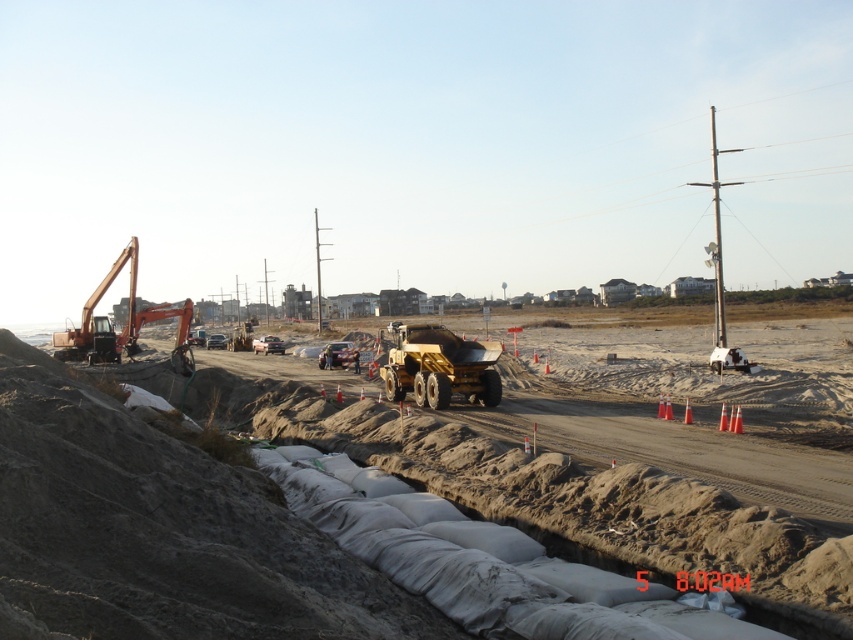
You are a construction worker standing at the edge of the trench filled with white sandbags. You need to move a heavy equipment part from the matte yellow truck at center to the yellow metallic dump truck at center. What is the minimum distance you need to carry the part?

The matte yellow truck at center and yellow metallic dump truck at center are 6.50 meters apart, so the minimum distance you need to carry the part is 6.50 meters.

You are a construction worker who needs to transport materials from the orange metallic excavator at left to the matte yellow truck at center. Considering their sizes, which vehicle can carry more materials?

The matte yellow truck at center is larger in size than the orange metallic excavator at left, so it can carry more materials.

You are a construction worker who needs to determine which vehicle can fit through a narrow pathway between two sandbags. Based on the image, which vehicle, the yellow metallic dump truck at center or the orange metallic excavator at left, is narrower?

The yellow metallic dump truck at center has a lesser width compared to the orange metallic excavator at left, so the yellow metallic dump truck at center is narrower and can fit through the narrow pathway between the two sandbags.